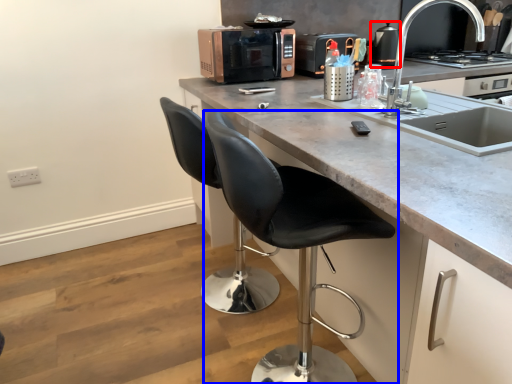
Question: Which of the following is the farthest to the observer, appliance (highlighted by a red box) or chair (highlighted by a blue box)?

Choices:
 (A) appliance
 (B) chair

Answer: (A)